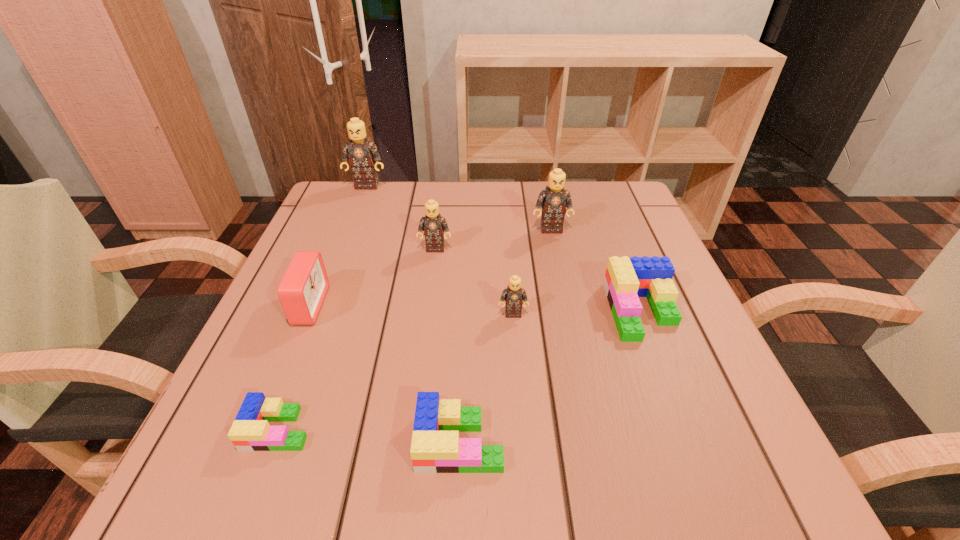
The image size is (960, 540). What are the coordinates of `empty space between the alarm clock and the sixth nearest object` in the screenshot? It's located at (372, 277).

You are a GUI agent. You are given a task and a screenshot of the screen. Output one action in this format:
    pyautogui.click(x=<x>, y=<y>)
    Task: Click on the vacant area that lies between the tallest Lego and the alarm clock
    The width and height of the screenshot is (960, 540).
    Given the screenshot: What is the action you would take?
    pyautogui.click(x=338, y=246)

I want to click on empty space between the alarm clock and the leftmost green Lego, so click(x=294, y=367).

Image resolution: width=960 pixels, height=540 pixels. I want to click on vacant point located between the third nearest tan Lego and the farthest object, so click(459, 207).

Identify the location of object that is the sixth closest to the second smallest tan Lego. Image resolution: width=960 pixels, height=540 pixels. (436, 447).

The height and width of the screenshot is (540, 960). I want to click on object that is the third nearest to the farthest tan Lego, so click(554, 199).

Choose which Lego is the sixth nearest neighbor to the sixth object from left to right. Please provide its 2D coordinates. Your answer should be formatted as a tuple, i.e. [(x, y)], where the tuple contains the x and y coordinates of a point satisfying the conditions above.

[(362, 154)]

The width and height of the screenshot is (960, 540). In order to click on Lego that stands as the second closest to the second nearest tan Lego in this screenshot , I will do `click(513, 295)`.

Locate which tan Lego ranks in proximity to the farthest tan Lego. Please provide its 2D coordinates. Your answer should be formatted as a tuple, i.e. [(x, y)], where the tuple contains the x and y coordinates of a point satisfying the conditions above.

[(433, 225)]

Locate which tan Lego is the second closest to the shortest Lego. Please provide its 2D coordinates. Your answer should be formatted as a tuple, i.e. [(x, y)], where the tuple contains the x and y coordinates of a point satisfying the conditions above.

[(433, 225)]